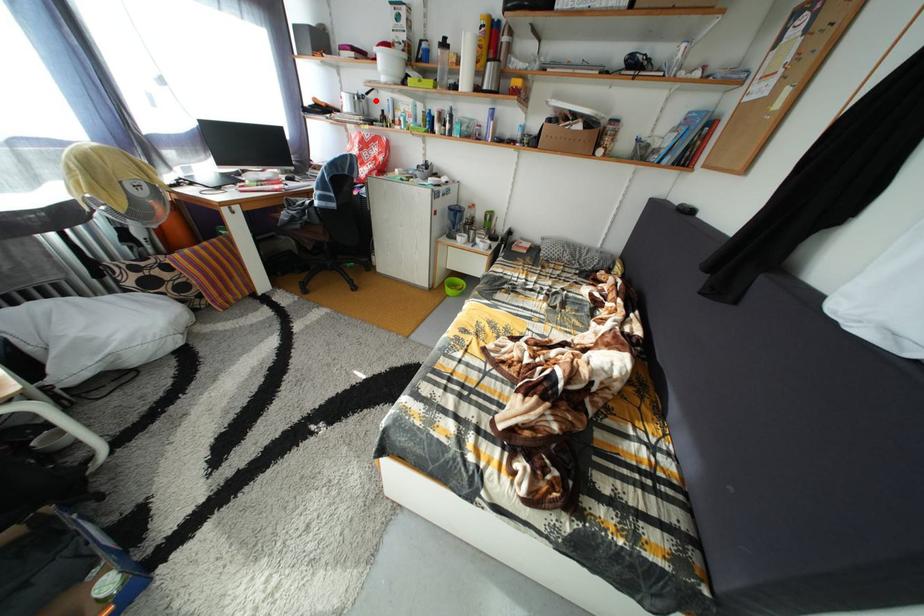
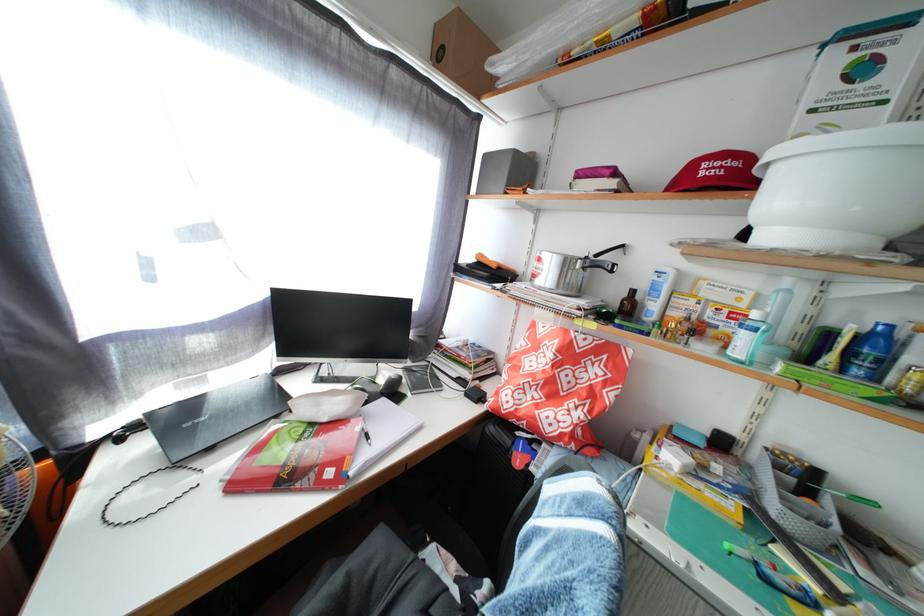
Question: A red point is marked in image1. In image2, is the corresponding 3D point closer to the camera or farther? Reply with the corresponding letter.

Choices:
 (A) The corresponding 3D point is closer.
 (B) The corresponding 3D point is farther.

Answer: (B)